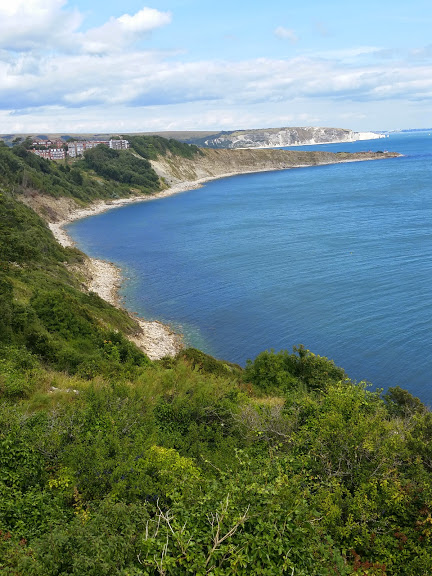
Where is `windows`? The height and width of the screenshot is (576, 432). windows is located at coordinates (54, 150), (59, 149).